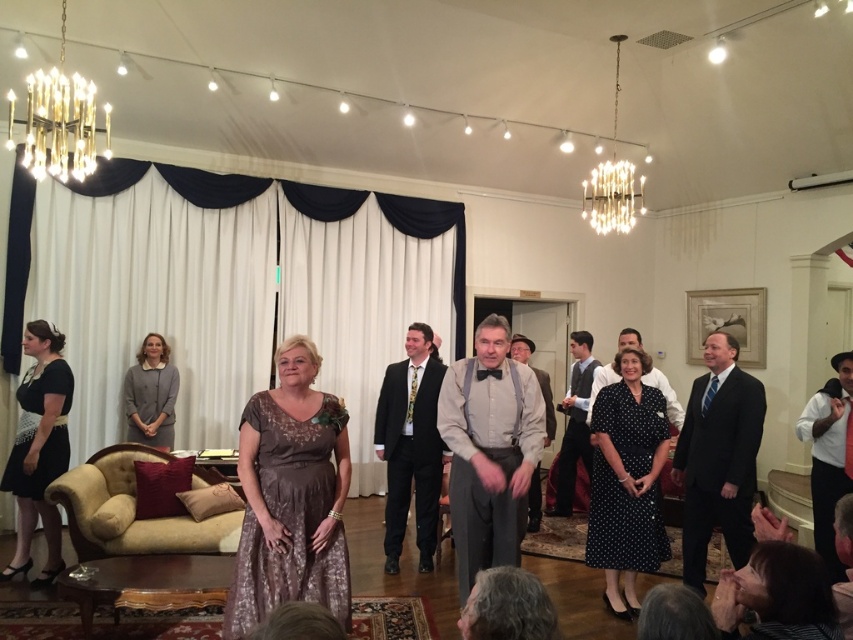
Question: Can you confirm if matte brown dress at center is positioned to the right of dark gray vest at center?

Choices:
 (A) no
 (B) yes

Answer: (A)

Question: Does dark suit at right have a smaller size compared to black satin dress at left?

Choices:
 (A) no
 (B) yes

Answer: (A)

Question: Which point is closer to the camera taking this photo?

Choices:
 (A) (596, 532)
 (B) (450, 632)
 (C) (397, 504)
 (D) (531, 528)

Answer: (B)

Question: Which of these objects is positioned closest to the matte brown dress at center?

Choices:
 (A) black dotted fabric dress at center
 (B) dark suit at right

Answer: (A)

Question: Which object is positioned farthest from the white satin bow tie at lower right?

Choices:
 (A) brown lace dress at center
 (B) light gray fabric bow tie at center
 (C) black satin suit at center
 (D) light beige fabric shirt at center

Answer: (A)

Question: In this image, where is matte brown dress at center located relative to light brown suit at center?

Choices:
 (A) above
 (B) below

Answer: (B)